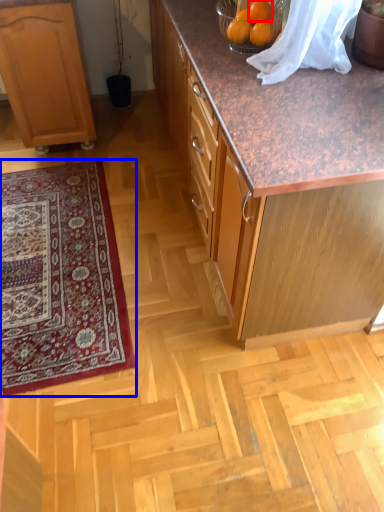
Question: Which object is closer to the camera taking this photo, orange (highlighted by a red box) or mat (highlighted by a blue box)?

Choices:
 (A) orange
 (B) mat

Answer: (A)